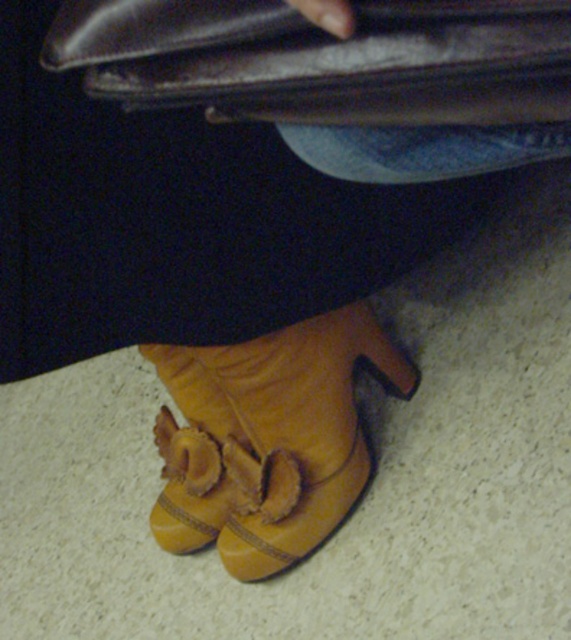
You are organizing items in a closet and see the leather bag at upper center and the suede boot at lower center. Which object is positioned more to the right side?

The leather bag at upper center is positioned more to the right side than the suede boot at lower center.

You are a fashion designer observing the image. You need to decide whether the leather bag at upper center can be seen in full without moving the suede boot at lower center. Based on the spatial arrangement, what do you think?

The leather bag at upper center is positioned over the suede boot at lower center, so it is already visible in its current position without needing to move the boot.